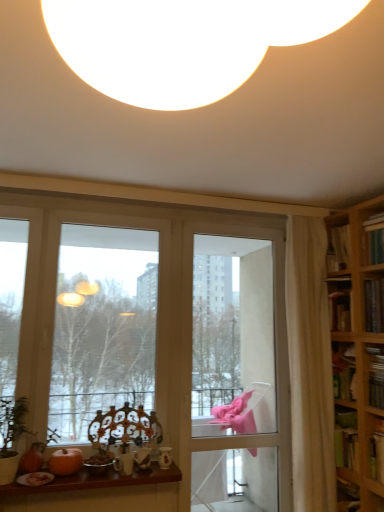
Question: In terms of width, does hardcover book at right, marked as the third book in a top-to-bottom arrangement, look wider or thinner when compared to transparent glass window at center?

Choices:
 (A) thin
 (B) wide

Answer: (B)

Question: From the image's perspective, is hardcover book at right, marked as the third book in a top-to-bottom arrangement, above or below transparent glass window at center?

Choices:
 (A) below
 (B) above

Answer: (A)

Question: Estimate the real-world distances between objects in this image. Which object is farther from the white sheer curtain at right?

Choices:
 (A) wooden table at lower center
 (B) clear glass screen door at center
 (C) orange matte pumpkin at lower left
 (D) hardcover book at right, which ranks as the 2th book in top-to-bottom order
 (E) transparent glass window at center

Answer: (C)

Question: Which is nearer to the hardcover book at right, marked as the third book in a top-to-bottom arrangement?

Choices:
 (A) orange matte pumpkin at lower left
 (B) clear glass screen door at center
 (C) wooden table at lower center
 (D) white sheer curtain at right
 (E) hardcover book at right, which appears as the 2th book when ordered from the bottom

Answer: (E)